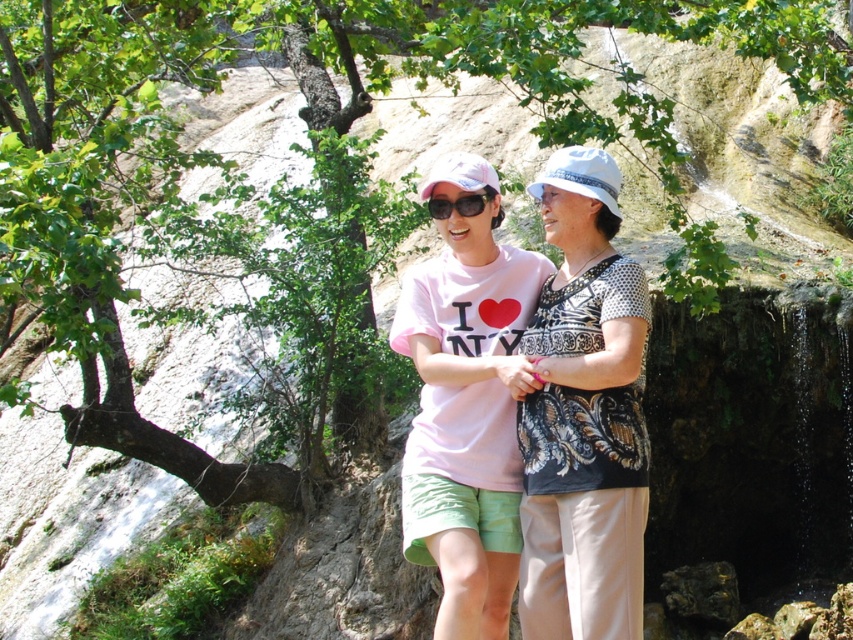
Question: Is pink cotton t-shirt at center wider than black plastic sunglasses at center?

Choices:
 (A) yes
 (B) no

Answer: (A)

Question: Which point appears closest to the camera in this image?

Choices:
 (A) (434, 212)
 (B) (405, 316)

Answer: (B)

Question: Is pink cotton t-shirt at center wider than black plastic sunglasses at center?

Choices:
 (A) yes
 (B) no

Answer: (A)

Question: Which point is farther to the camera?

Choices:
 (A) (480, 328)
 (B) (474, 193)

Answer: (A)

Question: Is pink cotton t-shirt at center behind black plastic sunglasses at center?

Choices:
 (A) no
 (B) yes

Answer: (A)